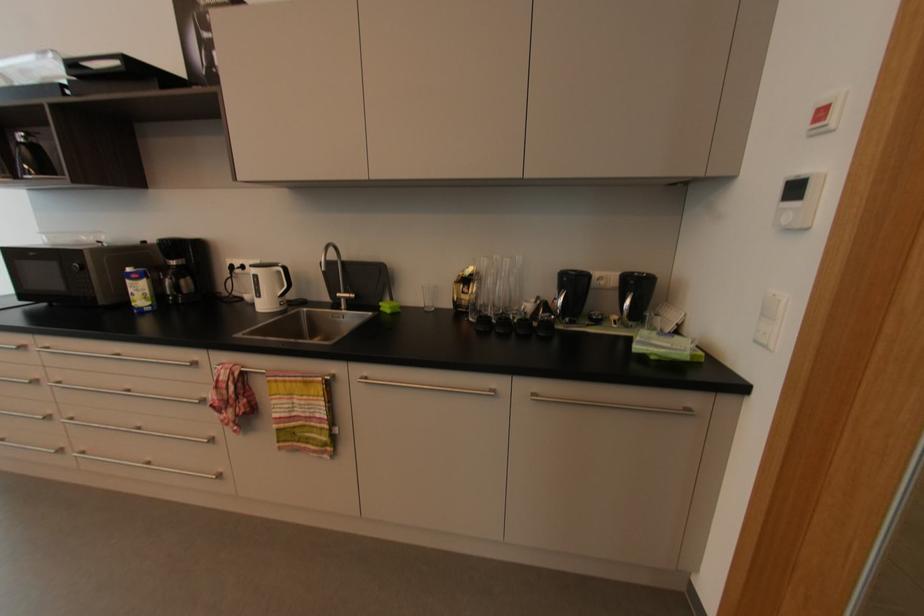
Identify the location of faucet handle. The image size is (924, 616). (346, 293).